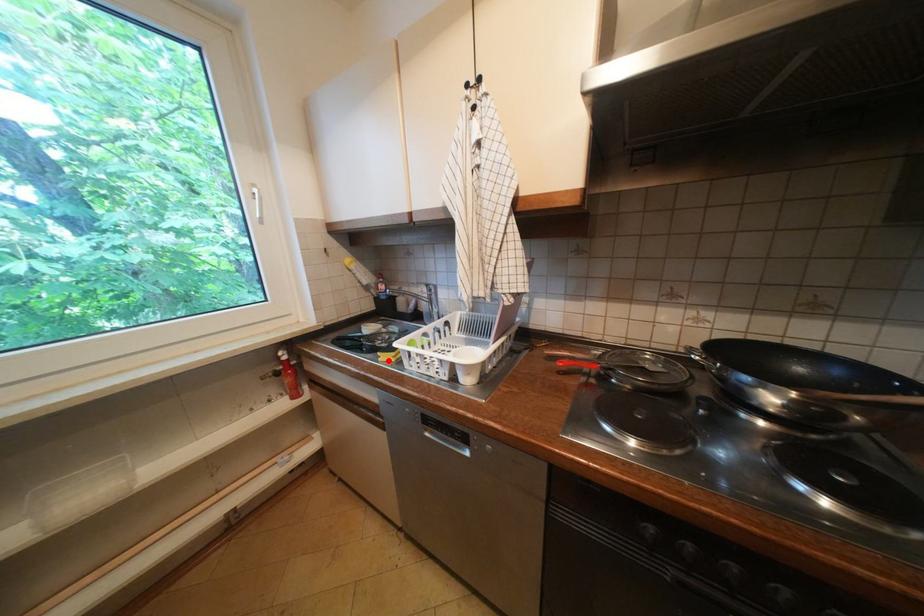
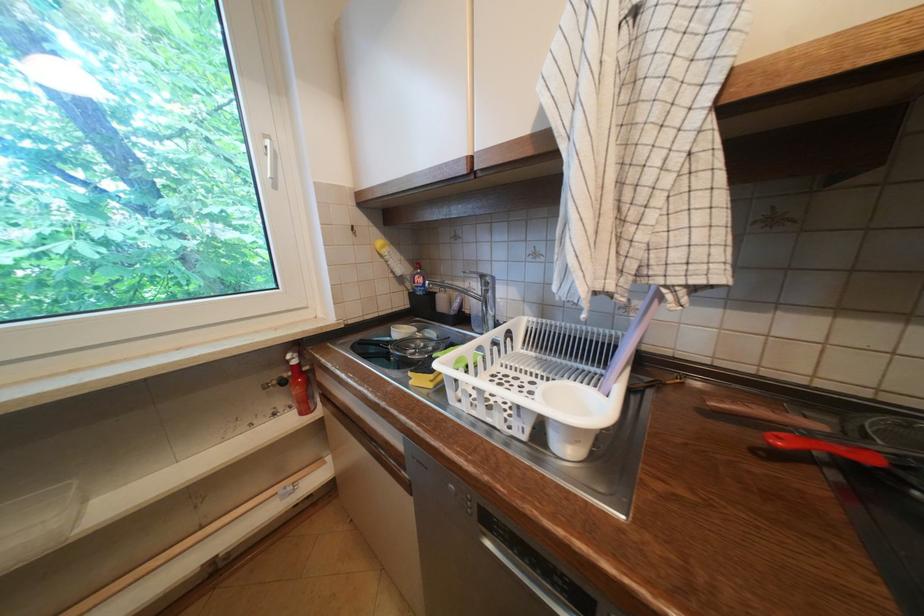
Where in the second image is the point corresponding to the highlighted location from the first image?

(419, 383)